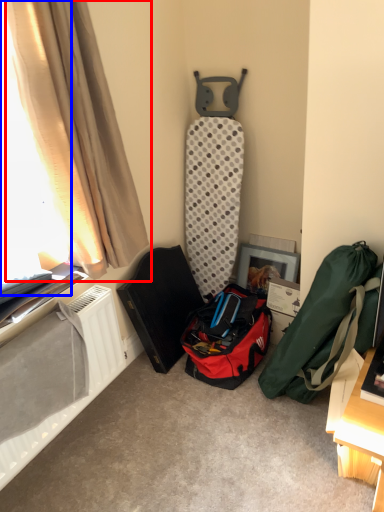
Question: Which object appears closest to the camera in this image, curtain (highlighted by a red box) or window screen (highlighted by a blue box)?

Choices:
 (A) curtain
 (B) window screen

Answer: (B)